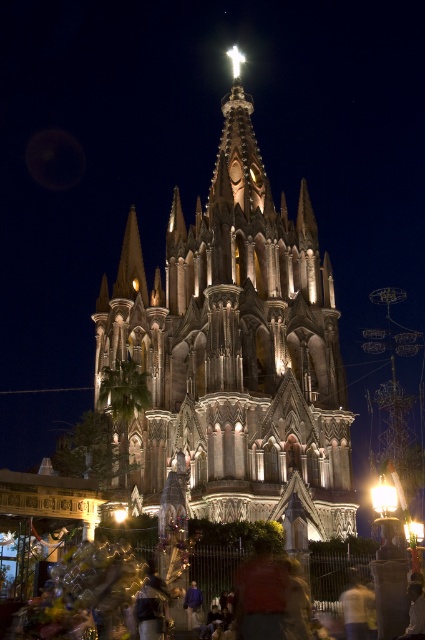
Question: Which point is farther to the camera?

Choices:
 (A) (189, 596)
 (B) (320, 486)

Answer: (B)

Question: Does dark brown stone tower at center lie in front of purple fabric at center?

Choices:
 (A) no
 (B) yes

Answer: (A)

Question: Which point appears closest to the camera in this image?

Choices:
 (A) (234, 248)
 (B) (197, 620)

Answer: (B)

Question: Does dark brown stone tower at center appear on the left side of purple fabric at center?

Choices:
 (A) yes
 (B) no

Answer: (A)

Question: Which point is closer to the camera?

Choices:
 (A) (153, 477)
 (B) (195, 586)

Answer: (B)

Question: Is dark brown stone tower at center further to the viewer compared to purple fabric at center?

Choices:
 (A) no
 (B) yes

Answer: (B)